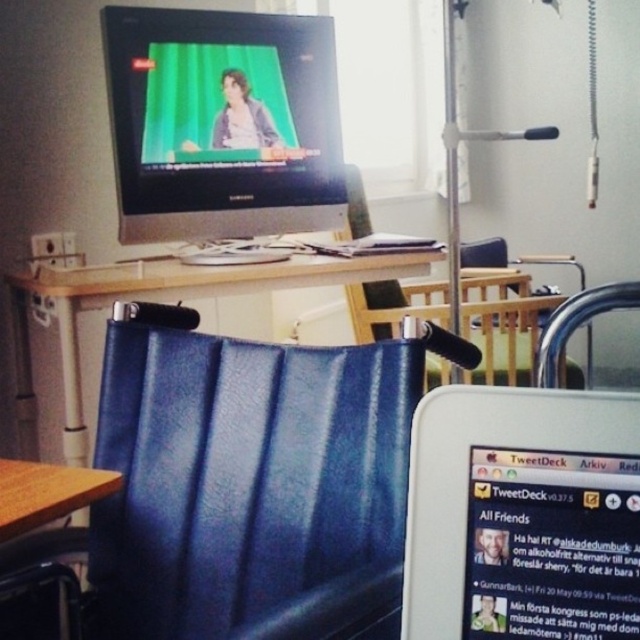
Is point (100, 406) positioned before point (51, 296)?

That is True.

Between blue leather swivel chair at center and wooden desk at center, which one has less height?

Standing shorter between the two is blue leather swivel chair at center.

Is point (218, 481) positioned before point (129, 288)?

Yes, it is.

Find the location of a particular element. This screenshot has width=640, height=640. blue leather swivel chair at center is located at coordinates (243, 486).

Is blue leather swivel chair at center shorter than brown wooden table at lower left?

Incorrect, blue leather swivel chair at center's height does not fall short of brown wooden table at lower left's.

Is point (284, 408) farther from viewer compared to point (88, 499)?

Yes, it is.

Locate an element on the screen. blue leather swivel chair at center is located at coordinates (243, 486).

You are a GUI agent. You are given a task and a screenshot of the screen. Output one action in this format:
    pyautogui.click(x=<x>, y=<y>)
    Task: Click on the blue leather swivel chair at center
    This screenshot has height=640, width=640.
    Given the screenshot: What is the action you would take?
    pyautogui.click(x=243, y=486)

Does blue leather swivel chair at center have a lesser height compared to matte black monitor at upper center?

Yes.

Is blue leather swivel chair at center closer to camera compared to matte black monitor at upper center?

Yes, blue leather swivel chair at center is closer to the viewer.

Does point (371, 461) lie in front of point (129, 189)?

Yes, it is in front of point (129, 189).

Image resolution: width=640 pixels, height=640 pixels. Identify the location of blue leather swivel chair at center. (243, 486).